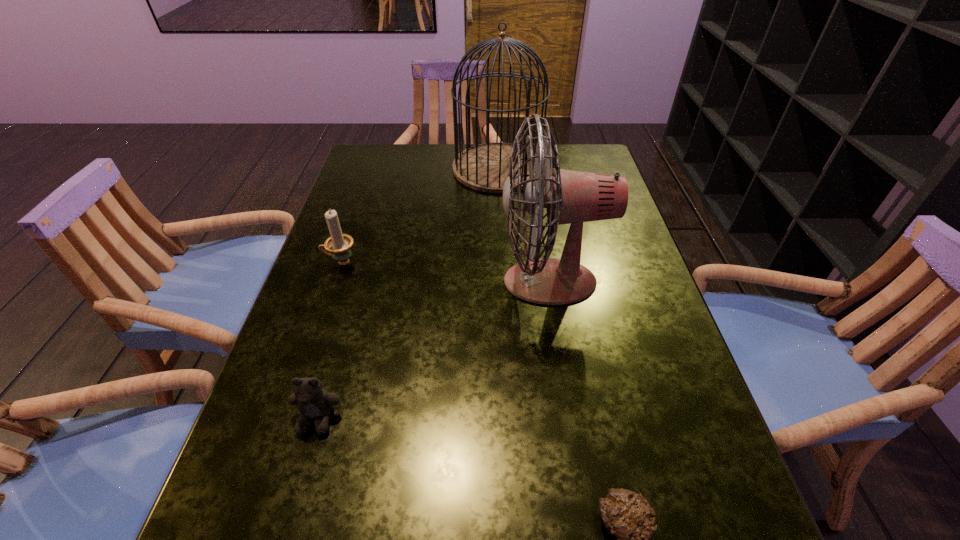
This screenshot has height=540, width=960. What are the coordinates of `the farthest object` in the screenshot? It's located at [484, 167].

Find the location of a particular element. fan is located at coordinates (570, 197).

Find the location of a particular element. The width and height of the screenshot is (960, 540). candle_holder is located at coordinates tap(339, 244).

The height and width of the screenshot is (540, 960). Identify the location of teddy bear. (314, 403).

Locate an element on the screen. This screenshot has width=960, height=540. the second nearest object is located at coordinates (314, 403).

Identify the location of blank space located at the door of the birdcage. The width and height of the screenshot is (960, 540). (407, 168).

Where is `vacant point located at the door of the birdcage`? vacant point located at the door of the birdcage is located at coordinates [391, 168].

Identify the location of blank space located at the door of the birdcage. (407, 168).

Identify the location of vacant space located 0.230m in front of the fan to direct airflow. pos(398,281).

Find the location of `vacant region located in front of the fan to direct airflow`. vacant region located in front of the fan to direct airflow is located at coordinates (412, 281).